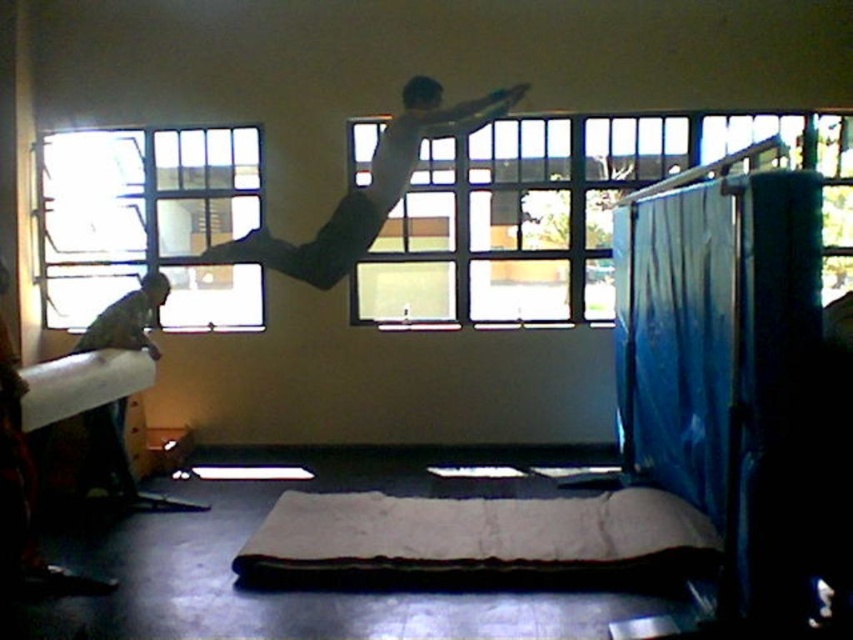
Looking at this image, does gray fabric mat at center have a larger size compared to white cardboard at left?

Yes, gray fabric mat at center is bigger than white cardboard at left.

Measure the distance between point (694,557) and camera.

The distance of point (694,557) from camera is 3.48 meters.

Locate an element on the screen. This screenshot has width=853, height=640. gray fabric mat at center is located at coordinates (476, 540).

Which of these two, white matte shirt at upper center or white cardboard at left, stands shorter?

With less height is white cardboard at left.

Between point (318, 250) and point (62, 403), which one is positioned in front?

Point (62, 403) is in front.

You are a GUI agent. You are given a task and a screenshot of the screen. Output one action in this format:
    pyautogui.click(x=<x>, y=<y>)
    Task: Click on the white matte shirt at upper center
    This screenshot has width=853, height=640.
    Given the screenshot: What is the action you would take?
    pyautogui.click(x=364, y=189)

Based on the photo, between clear glass window at upper center and white matte shirt at upper center, which one has more height?

With more height is clear glass window at upper center.

Does clear glass window at upper center have a lesser width compared to white matte shirt at upper center?

No.

Which is in front, point (537, 140) or point (314, 264)?

Point (314, 264)

In order to click on clear glass window at upper center in this screenshot , I will do `click(550, 211)`.